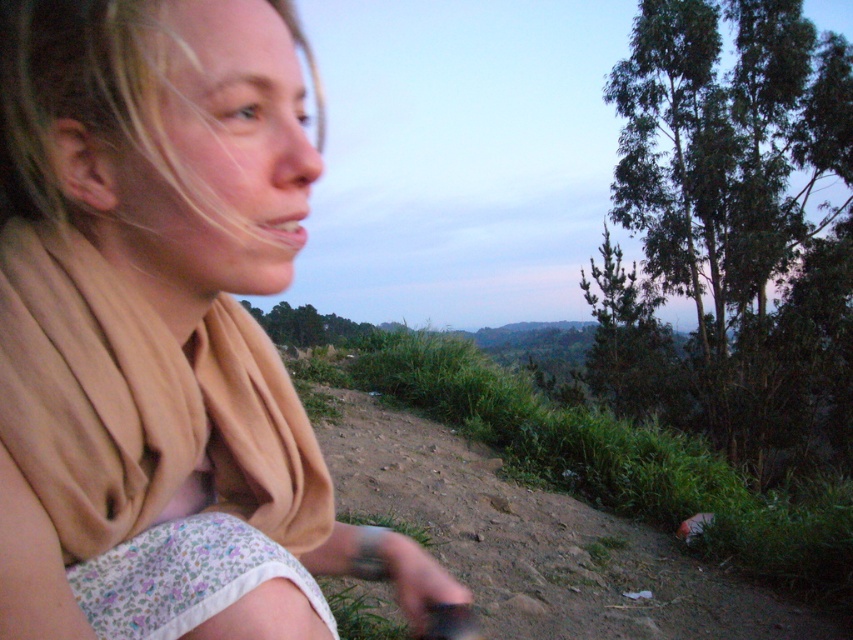
Based on the photo, who is lower down, beige fabric scarf at upper left or brown dirt track at lower center?

Positioned lower is brown dirt track at lower center.

What do you see at coordinates (161, 333) in the screenshot? Image resolution: width=853 pixels, height=640 pixels. I see `beige fabric scarf at upper left` at bounding box center [161, 333].

Image resolution: width=853 pixels, height=640 pixels. Identify the location of beige fabric scarf at upper left. (161, 333).